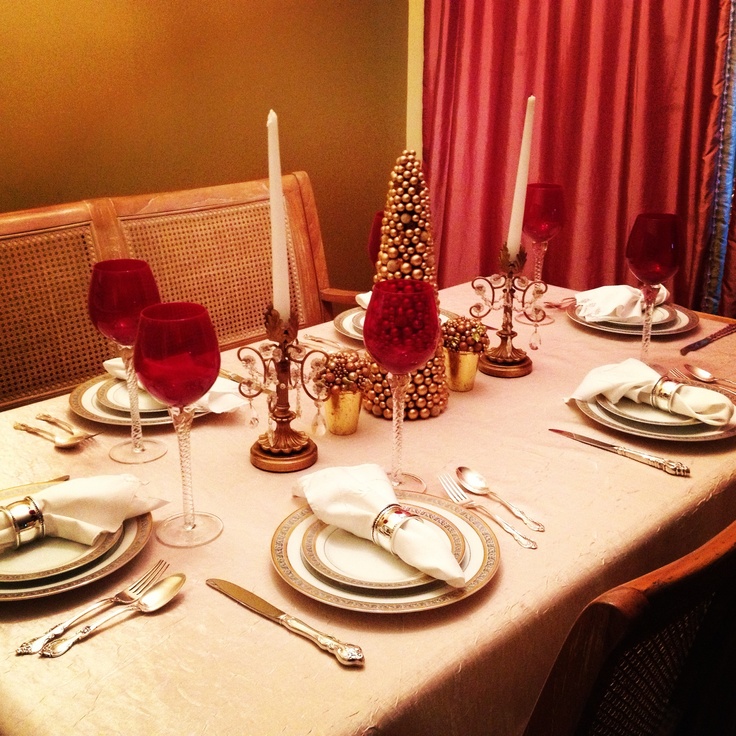
Find the location of a particular element. bread plate is located at coordinates (56, 559), (344, 570), (664, 417), (631, 325), (360, 325), (112, 394).